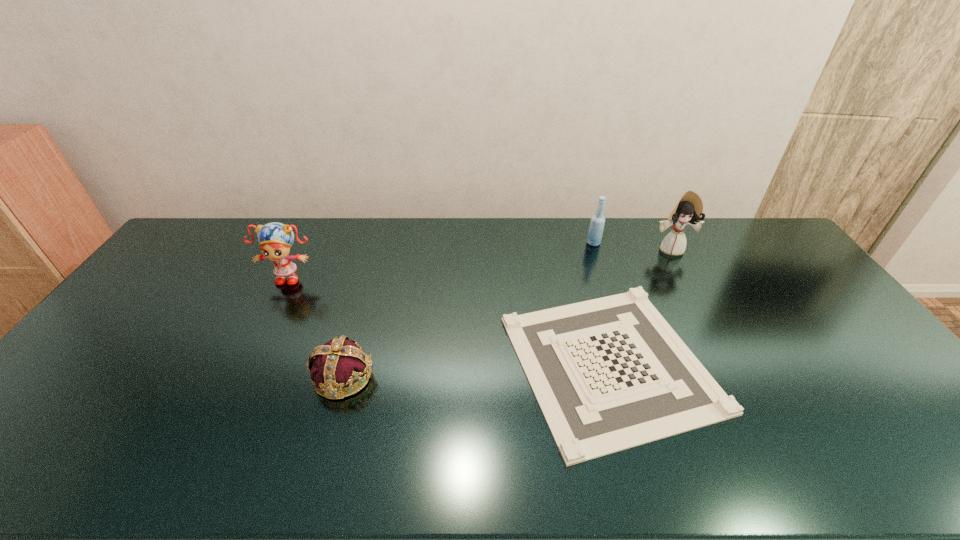
Identify which object is the second nearest to the checkerboard. Please provide its 2D coordinates. Your answer should be formatted as a tuple, i.e. [(x, y)], where the tuple contains the x and y coordinates of a point satisfying the conditions above.

[(595, 232)]

The image size is (960, 540). Find the location of `free region that satisfies the following two spatial constraints: 1. on the back side of the bottle; 2. on the right side of the shortest object`. free region that satisfies the following two spatial constraints: 1. on the back side of the bottle; 2. on the right side of the shortest object is located at coordinates (577, 243).

The width and height of the screenshot is (960, 540). In order to click on vacant space that satisfies the following two spatial constraints: 1. on the back side of the bottle; 2. on the right side of the second shortest object in this screenshot , I will do `click(381, 243)`.

Where is `free space in the image that satisfies the following two spatial constraints: 1. on the face of the left doll; 2. on the right side of the shortest object`? Image resolution: width=960 pixels, height=540 pixels. free space in the image that satisfies the following two spatial constraints: 1. on the face of the left doll; 2. on the right side of the shortest object is located at coordinates 246,363.

Image resolution: width=960 pixels, height=540 pixels. In order to click on free location that satisfies the following two spatial constraints: 1. on the face of the crown; 2. on the left side of the third nearest object in this screenshot , I will do `click(239, 376)`.